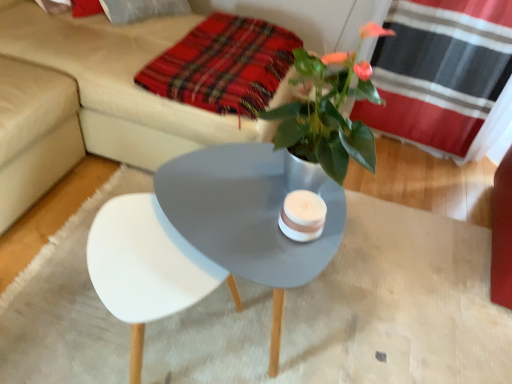
Where is `beige fabric couch at upper center`? Image resolution: width=512 pixels, height=384 pixels. beige fabric couch at upper center is located at coordinates (103, 99).

The width and height of the screenshot is (512, 384). Describe the element at coordinates (223, 65) in the screenshot. I see `plaid fabric at upper center` at that location.

Where is `beige fabric couch at upper center`? beige fabric couch at upper center is located at coordinates click(x=103, y=99).

Is beige fabric couch at upper center not close to metallic silver plant at center?

beige fabric couch at upper center is actually quite close to metallic silver plant at center.

Is metallic silver plant at center surrounded by beige fabric couch at upper center?

That's incorrect, metallic silver plant at center is not inside beige fabric couch at upper center.

Which point is more forward, (133, 111) or (297, 115)?

The point (297, 115) is closer to the camera.

Is beige fabric couch at upper center thinner than metallic silver plant at center?

No, beige fabric couch at upper center is not thinner than metallic silver plant at center.

Between plaid fabric at upper center and metallic silver plant at center, which one has less height?

plaid fabric at upper center is shorter.

Is the surface of plaid fabric at upper center in direct contact with metallic silver plant at center?

No, plaid fabric at upper center is not in contact with metallic silver plant at center.

From the image's perspective, between plaid fabric at upper center and metallic silver plant at center, which one is located above?

From the image's view, plaid fabric at upper center is above.

Is metallic silver plant at center shorter than beige fabric couch at upper center?

Correct, metallic silver plant at center is not as tall as beige fabric couch at upper center.

Is metallic silver plant at center located outside beige fabric couch at upper center?

That's correct, metallic silver plant at center is outside of beige fabric couch at upper center.

Is metallic silver plant at center turned away from beige fabric couch at upper center?

That's not correct — metallic silver plant at center is not looking away from beige fabric couch at upper center.

Is metallic silver plant at center positioned far away from beige fabric couch at upper center?

metallic silver plant at center is actually quite close to beige fabric couch at upper center.

From the image's perspective, is metallic silver plant at center located above plaid fabric at upper center?

No, from the image's perspective, metallic silver plant at center is not over plaid fabric at upper center.

From a real-world perspective, is metallic silver plant at center below plaid fabric at upper center?

No, from a real-world perspective, metallic silver plant at center is not under plaid fabric at upper center.

Is metallic silver plant at center wider or thinner than plaid fabric at upper center?

Clearly, metallic silver plant at center has less width compared to plaid fabric at upper center.

Between metallic silver plant at center and plaid fabric at upper center, which one is positioned in front?

metallic silver plant at center.

Which of these two, plaid fabric at upper center or beige fabric couch at upper center, is smaller?

plaid fabric at upper center.

From the image's perspective, is plaid fabric at upper center below beige fabric couch at upper center?

Yes.

From a real-world perspective, does plaid fabric at upper center stand above beige fabric couch at upper center?

Yes.

Considering the positions of point (266, 50) and point (186, 110), is point (266, 50) closer or farther from the camera than point (186, 110)?

Point (266, 50) is positioned farther from the camera compared to point (186, 110).

Considering their positions, is beige fabric couch at upper center located in front of or behind plaid fabric at upper center?

Clearly, beige fabric couch at upper center is in front of plaid fabric at upper center.

Based on their sizes in the image, would you say beige fabric couch at upper center is bigger or smaller than plaid fabric at upper center?

Considering their sizes, beige fabric couch at upper center takes up more space than plaid fabric at upper center.

Is beige fabric couch at upper center shorter than plaid fabric at upper center?

In fact, beige fabric couch at upper center may be taller than plaid fabric at upper center.

Can you confirm if beige fabric couch at upper center is positioned to the right of plaid fabric at upper center?

No.

Locate an element on the screen. The image size is (512, 384). studio couch behind the metallic silver plant at center is located at coordinates tap(103, 99).

Locate an element on the screen. houseplant below the plaid fabric at upper center (from the image's perspective) is located at coordinates (327, 114).

Looking at the image, which one is located closer to metallic silver plant at center, beige fabric couch at upper center or plaid fabric at upper center?

plaid fabric at upper center.

Which object lies nearer to the anchor point plaid fabric at upper center, beige fabric couch at upper center or metallic silver plant at center?

The object closer to plaid fabric at upper center is beige fabric couch at upper center.

Estimate the real-world distances between objects in this image. Which object is closer to metallic silver plant at center, plaid fabric at upper center or beige fabric couch at upper center?

Result: Among the two, plaid fabric at upper center is located nearer to metallic silver plant at center.

Looking at the image, which one is located closer to plaid fabric at upper center, metallic silver plant at center or beige fabric couch at upper center?

The object closer to plaid fabric at upper center is beige fabric couch at upper center.

From the image, which object appears to be nearer to beige fabric couch at upper center, metallic silver plant at center or plaid fabric at upper center?

Among the two, plaid fabric at upper center is located nearer to beige fabric couch at upper center.

Looking at the image, which one is located closer to beige fabric couch at upper center, plaid fabric at upper center or metallic silver plant at center?

The object closer to beige fabric couch at upper center is plaid fabric at upper center.

Locate an element on the screen. blanket between beige fabric couch at upper center and metallic silver plant at center is located at coordinates (223, 65).